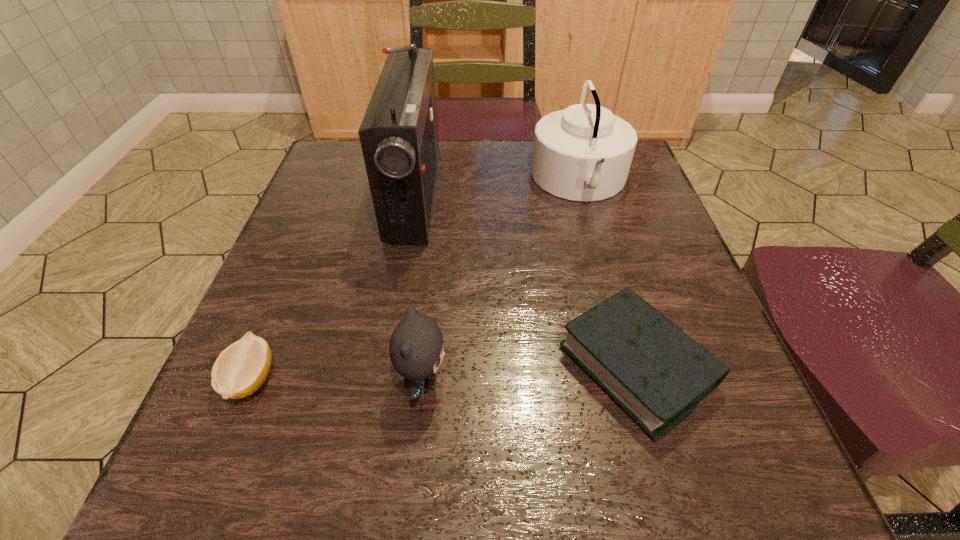
Where is `vacant position located 0.270m on the back of the Bible`? Image resolution: width=960 pixels, height=540 pixels. vacant position located 0.270m on the back of the Bible is located at coordinates (592, 210).

Identify the location of free space located 0.110m on the back of the leftmost object. The width and height of the screenshot is (960, 540). (284, 297).

You are a GUI agent. You are given a task and a screenshot of the screen. Output one action in this format:
    pyautogui.click(x=<x>, y=<y>)
    Task: Click on the radio receiver that is at the far edge
    
    Given the screenshot: What is the action you would take?
    pyautogui.click(x=399, y=139)

At what (x,y) coordinates should I click in order to perform the action: click on kettle situated at the far edge. Please return your answer as a coordinate pair (x, y). Looking at the image, I should click on (583, 153).

Identify the location of object at the near edge. The image size is (960, 540). (654, 371).

At what (x,y) coordinates should I click in order to perform the action: click on object that is at the left edge. Please return your answer as a coordinate pair (x, y). Looking at the image, I should click on (241, 368).

At what (x,y) coordinates should I click in order to perform the action: click on kettle present at the right edge. Please return your answer as a coordinate pair (x, y). The height and width of the screenshot is (540, 960). Looking at the image, I should click on (583, 153).

This screenshot has width=960, height=540. What are the coordinates of `Bible positioned at the right edge` in the screenshot? It's located at (654, 371).

Find the location of `object present at the far right corner`. object present at the far right corner is located at coordinates (583, 153).

Where is `object that is positioned at the near right corner`? Image resolution: width=960 pixels, height=540 pixels. object that is positioned at the near right corner is located at coordinates (654, 371).